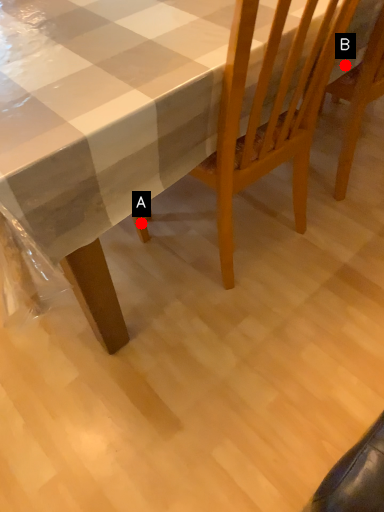
Question: Two points are circled on the image, labeled by A and B beside each circle. Which point is closer to the camera?

Choices:
 (A) A is closer
 (B) B is closer

Answer: (B)